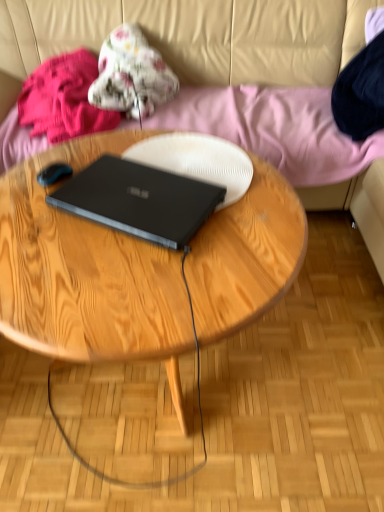
You are a GUI agent. You are given a task and a screenshot of the screen. Output one action in this format:
    pyautogui.click(x=<x>, y=<y>)
    Task: Click on the vacant region above wooden coffee table at center (from a real-world perspective)
    
    Given the screenshot: What is the action you would take?
    pyautogui.click(x=144, y=226)